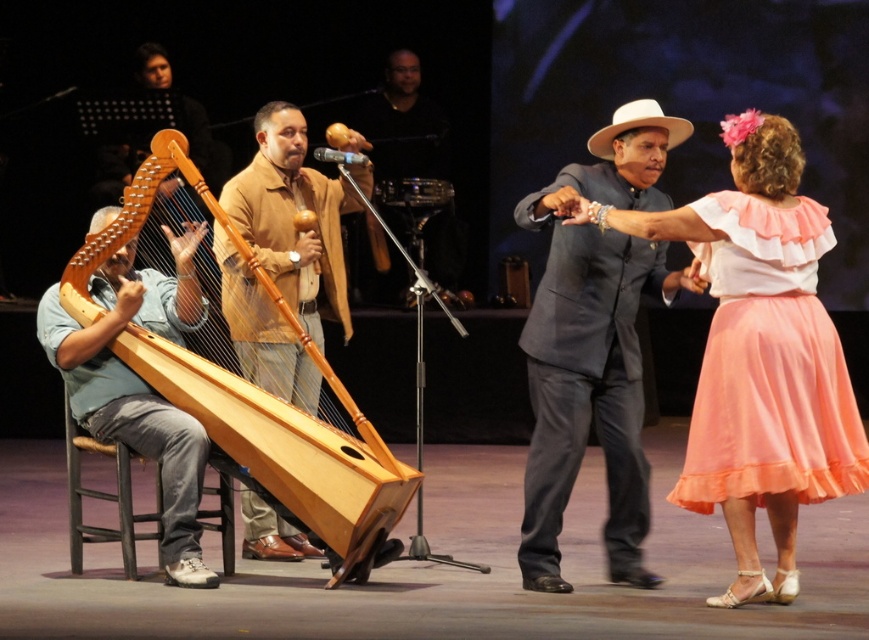
Question: Which object is closer to the camera taking this photo?

Choices:
 (A) dark gray suit at center
 (B) wooden harp at left
 (C) wooden harp at center

Answer: (A)

Question: In this image, where is wooden harp at center located relative to wooden harp at left?

Choices:
 (A) above
 (B) below

Answer: (A)

Question: Is dark gray suit at center positioned behind wooden harp at center?

Choices:
 (A) yes
 (B) no

Answer: (B)

Question: Can you confirm if dark gray suit at center is wider than wooden harp at center?

Choices:
 (A) yes
 (B) no

Answer: (A)

Question: Which of the following is the farthest from the observer?

Choices:
 (A) pink satin skirt at center
 (B) wooden harp at left

Answer: (B)

Question: Which point appears farthest from the camera in this image?

Choices:
 (A) (297, 273)
 (B) (67, 316)
 (C) (618, 525)
 (D) (779, 172)

Answer: (A)